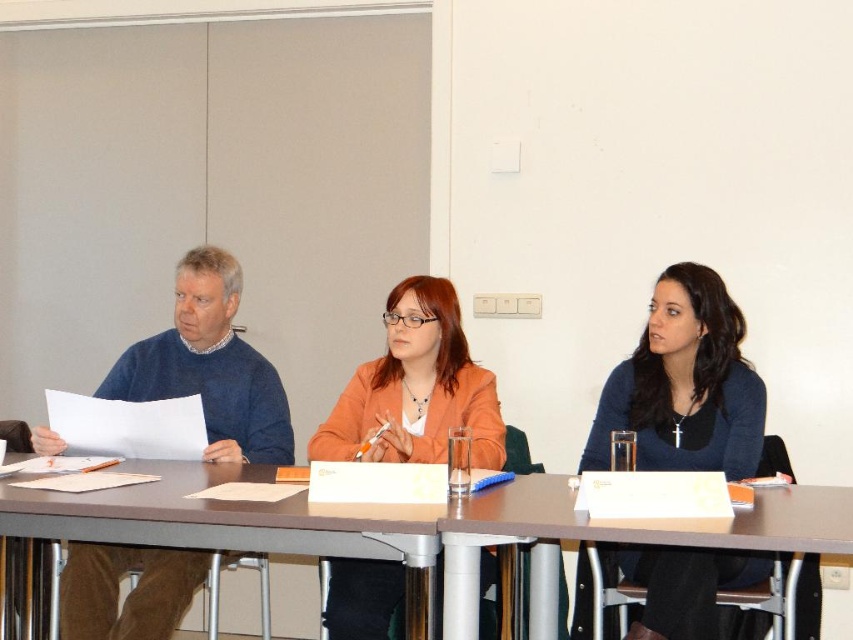
From the picture: Between blue sweater at left and orange matte jacket at center, which one has less height?

orange matte jacket at center

The image size is (853, 640). What are the coordinates of `blue sweater at left` in the screenshot? It's located at (x=210, y=365).

Is point (248, 403) in front of point (434, 320)?

No, (248, 403) is behind (434, 320).

The image size is (853, 640). Identify the location of blue sweater at left. (210, 365).

Between point (184, 536) and point (698, 552), which one is positioned behind?

Positioned behind is point (698, 552).

Where is `smooth wooden table at center`? The width and height of the screenshot is (853, 640). smooth wooden table at center is located at coordinates (410, 525).

Is dark blue sweater at center further to camera compared to smooth brown table at center?

Yes, dark blue sweater at center is behind smooth brown table at center.

Does dark blue sweater at center have a larger size compared to smooth brown table at center?

Yes.

Is point (701, 595) more distant than point (527, 490)?

Yes, it is behind point (527, 490).

In order to click on dark blue sweater at center in this screenshot , I will do `click(683, 385)`.